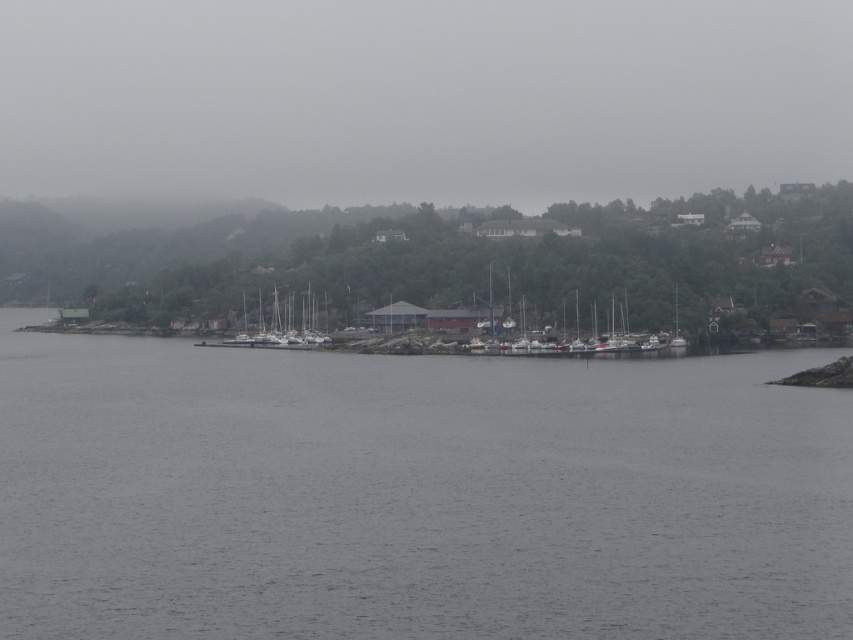
Question: Can you confirm if gray water at center is positioned above metallic gray boats at center?

Choices:
 (A) no
 (B) yes

Answer: (A)

Question: Among these objects, which one is nearest to the camera?

Choices:
 (A) gray water at center
 (B) white matte boats at center
 (C) metallic gray boats at center

Answer: (A)

Question: Which object is closer to the camera taking this photo?

Choices:
 (A) gray water at center
 (B) metallic gray boats at center

Answer: (A)

Question: Can you confirm if gray water at center is positioned to the right of metallic gray boats at center?

Choices:
 (A) yes
 (B) no

Answer: (A)

Question: Among these points, which one is farthest from the camera?

Choices:
 (A) (274, 301)
 (B) (306, 419)

Answer: (A)

Question: Can you confirm if gray water at center is positioned above metallic gray boats at center?

Choices:
 (A) no
 (B) yes

Answer: (A)